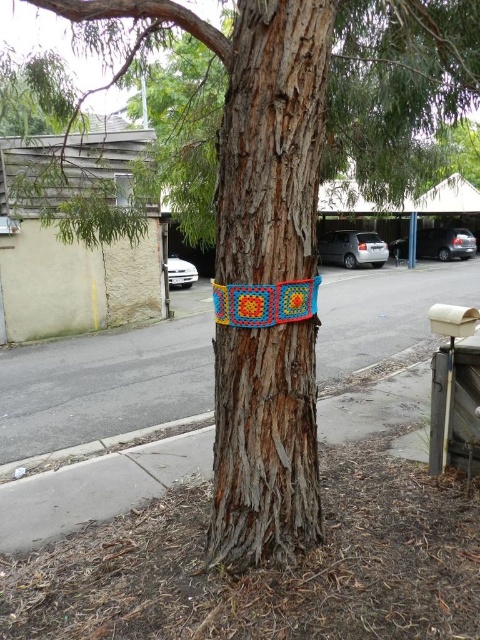
You are a delivery person trying to deliver a package to a house behind the wooden textured tree trunk at center and the knitted yarn blanket at center. The package is 1.2 meters wide. Can you pass through the space between these two objects?

The wooden textured tree trunk at center might be wider than knitted yarn blanket at center. Since the package is 1.2 meters wide, it is uncertain if the space between them is wide enough. Please check the actual width before proceeding.

From the picture: You are a delivery person trying to place a small package on the ground. The package is 0.5 meters wide. You see the textured concrete pavement at center and the knitted yarn blanket at center. Can you fit the package on either of these surfaces without overlapping them?

The textured concrete pavement at center is larger in size than the knitted yarn blanket at center. Since the package is 0.5 meters wide, it can fit on the textured concrete pavement at center as it has more space available.

You are standing at the entrance of a residential area and see the textured concrete pavement at center and the knitted yarn blanket at center. If you want to reach both objects, which one do you need to walk towards first?

The textured concrete pavement at center is 30.87 feet away from knitted yarn blanket at center, so you should walk towards the knitted yarn blanket at center first since it is closer to your current position.